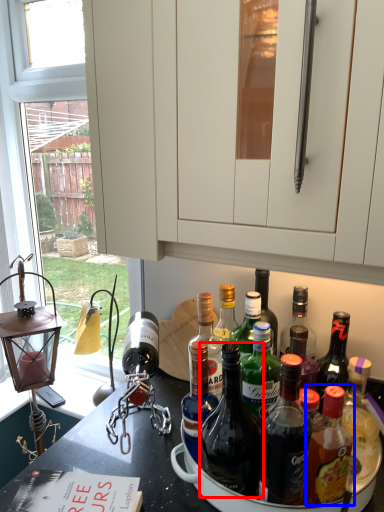
Question: Which object appears farthest to the camera in this image, bottle (highlighted by a red box) or bottle (highlighted by a blue box)?

Choices:
 (A) bottle
 (B) bottle

Answer: (A)